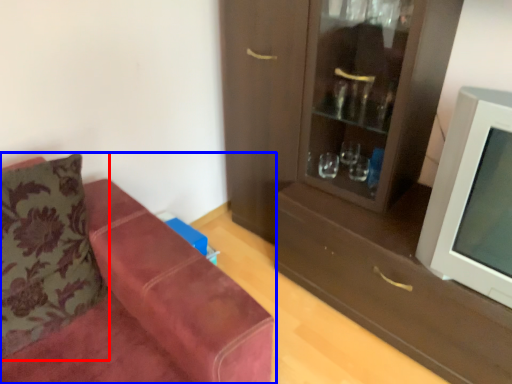
Question: Which point is closer to the camera, pillow (highlighted by a red box) or studio couch (highlighted by a blue box)?

Choices:
 (A) pillow
 (B) studio couch

Answer: (B)